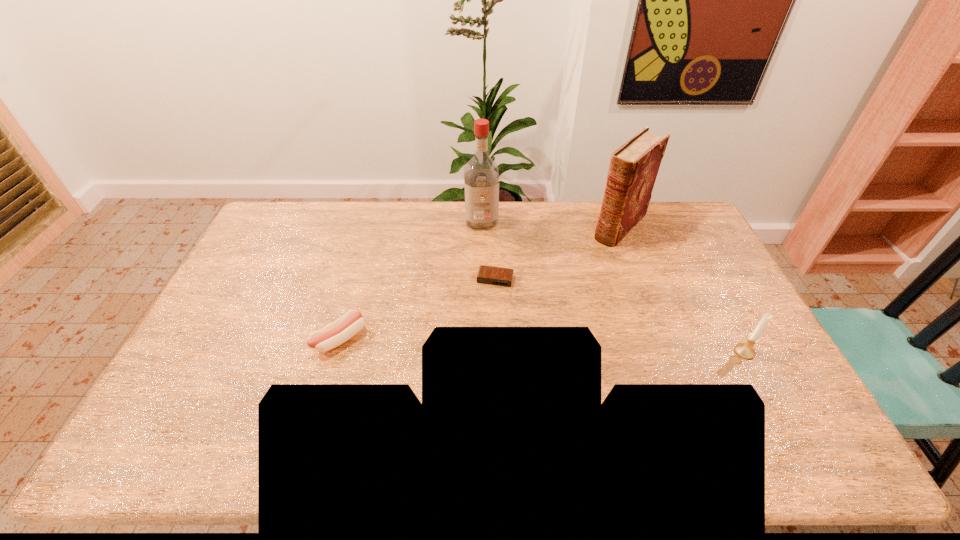
I want to click on vacant spot on the desktop that is between the fourth tallest object and the rightmost object and is positioned on the spine side of the hardback book, so click(502, 344).

Locate an element on the screen. vacant space on the desktop that is between the leftmost object and the rightmost object and is positioned on the front-facing side of the liquor is located at coordinates (492, 343).

Locate an element on the screen. vacant spot on the desktop that is between the second shortest object and the rightmost object and is positioned on the front face of the alarm clock is located at coordinates (481, 343).